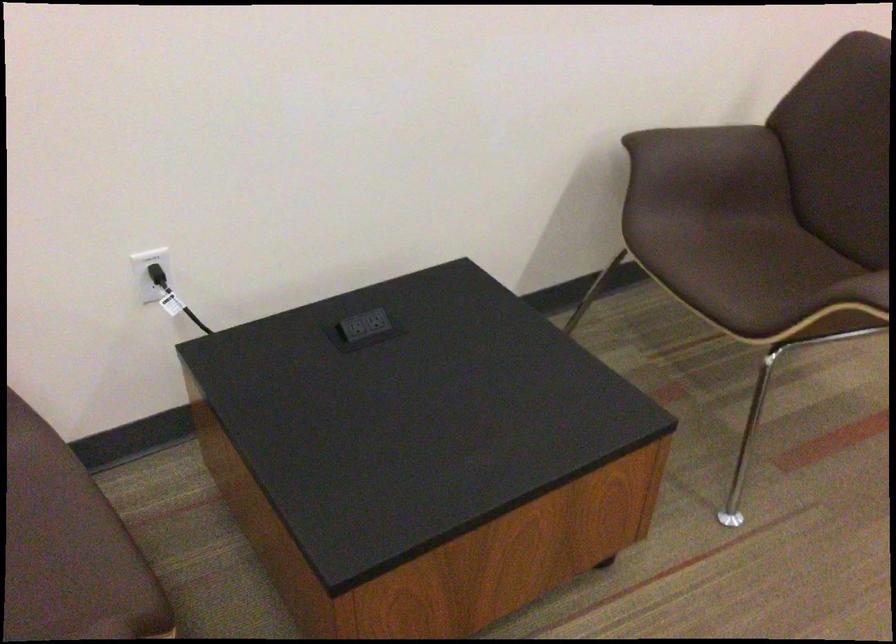
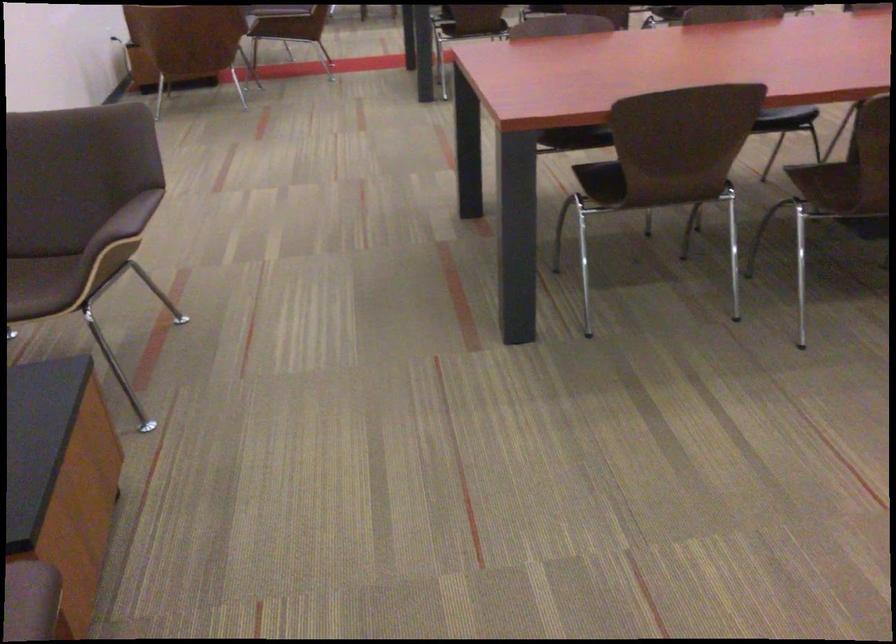
Question: The camera is either moving clockwise (left) or counter-clockwise (right) around the object. The first image is from the beginning of the video and the second image is from the end. Is the camera moving left or right when shooting the video?

Choices:
 (A) Left
 (B) Right

Answer: (A)